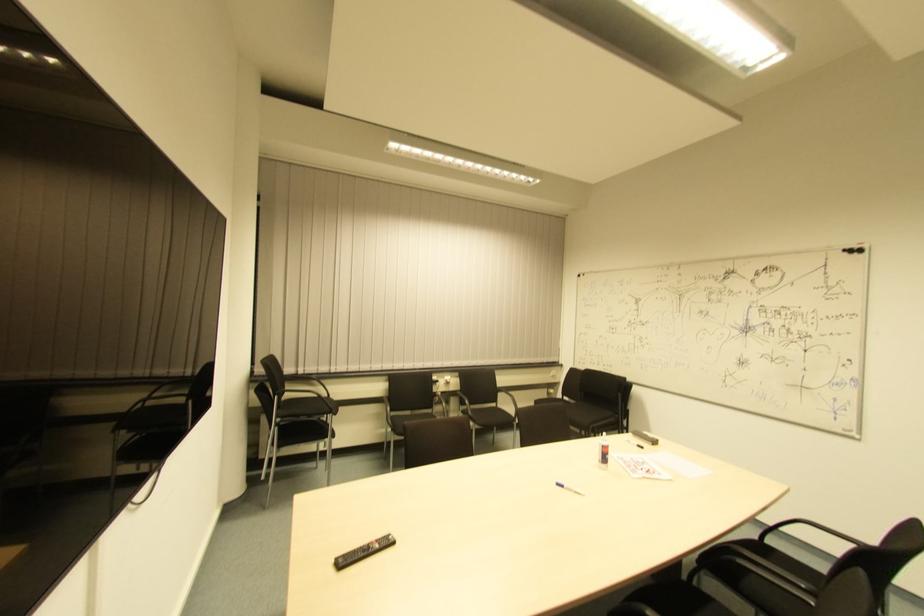
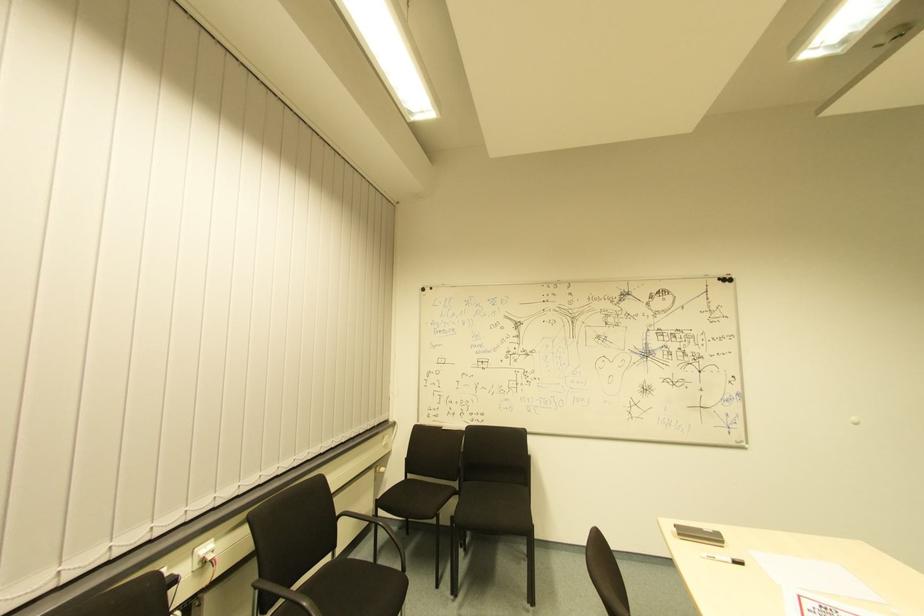
Locate, in the second image, the point that corresponds to (x=855, y=257) in the first image.

(725, 286)